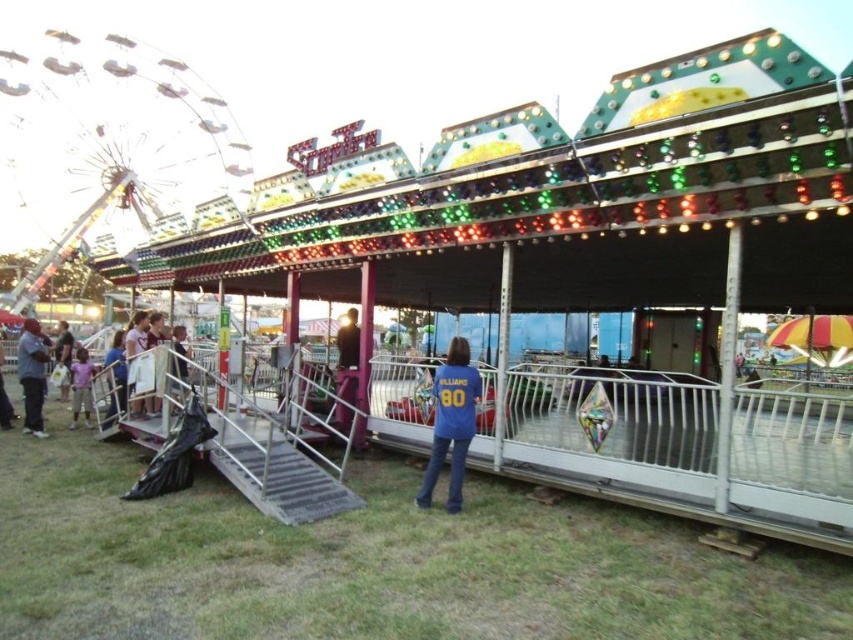
You are a photographer trying to capture the fairground scene. You notice two people in the foreground wearing a light purple shirt at lower left and a blue denim jacket at center. Which person should you focus on to ensure they take up more of the photo?

The blue denim jacket at center should be focused on because it occupies more space than the light purple shirt at lower left.